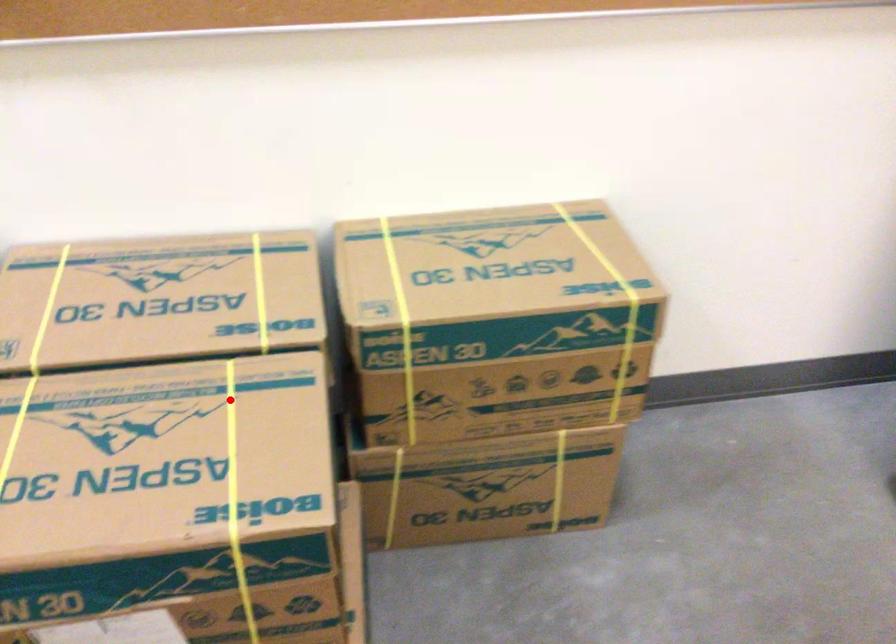
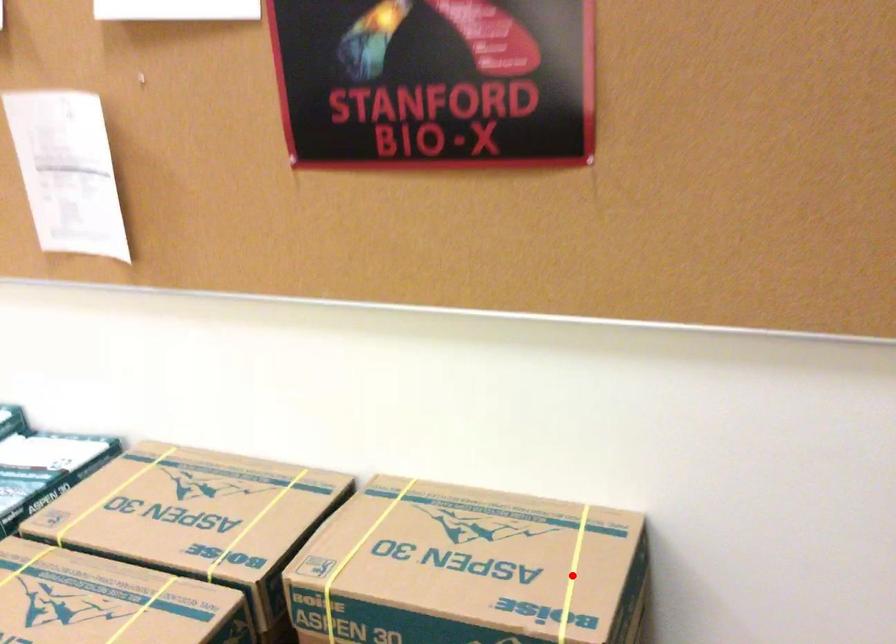
I am providing you with two images of the same scene from different viewpoints. A red point is marked on the first image and another point is marked on the second image. Do the highlighted points in image1 and image2 indicate the same real-world spot?

No